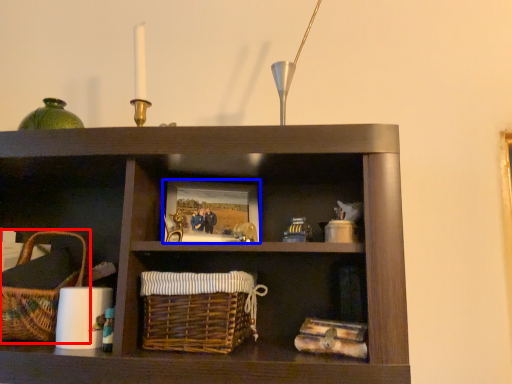
Question: Which object is closer to the camera taking this photo, picnic basket (highlighted by a red box) or picture frame (highlighted by a blue box)?

Choices:
 (A) picnic basket
 (B) picture frame

Answer: (A)